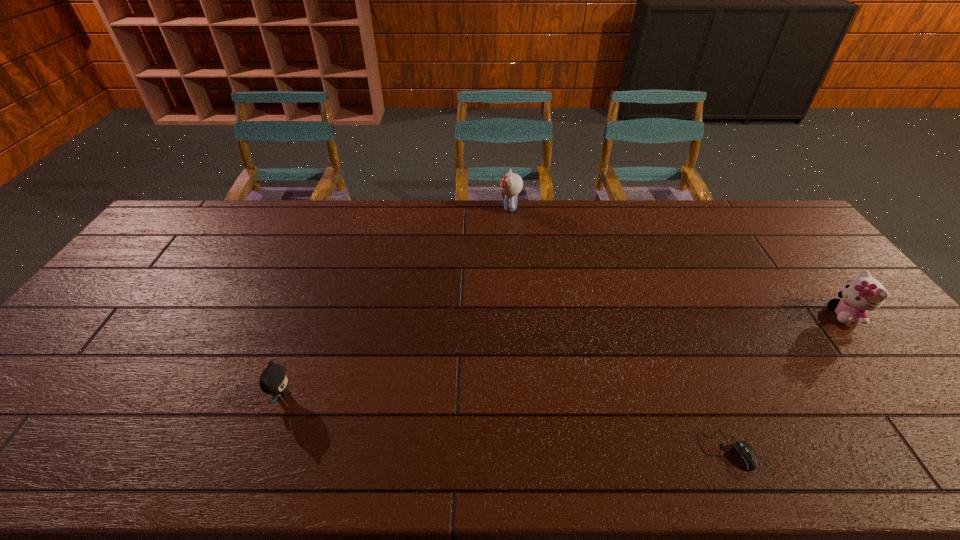
Find the location of a particular element. The width and height of the screenshot is (960, 540). free spot that satisfies the following two spatial constraints: 1. on the back side of the third object from left to right; 2. on the front-facing side of the nearest kitten is located at coordinates (703, 395).

You are a GUI agent. You are given a task and a screenshot of the screen. Output one action in this format:
    pyautogui.click(x=<x>, y=<y>)
    Task: Click on the free location that satisfies the following two spatial constraints: 1. on the front-facing side of the leftmost object; 2. on the left side of the shortest object
    
    Given the screenshot: What is the action you would take?
    pyautogui.click(x=262, y=450)

Where is `free region that satisfies the following two spatial constraints: 1. on the front-facing side of the shortest object; 2. on the left side of the third tallest object`? The image size is (960, 540). free region that satisfies the following two spatial constraints: 1. on the front-facing side of the shortest object; 2. on the left side of the third tallest object is located at coordinates (262, 450).

Where is `vacant area that satisfies the following two spatial constraints: 1. on the front-facing side of the farthest kitten; 2. on the right side of the shortest object`? The image size is (960, 540). vacant area that satisfies the following two spatial constraints: 1. on the front-facing side of the farthest kitten; 2. on the right side of the shortest object is located at coordinates (531, 450).